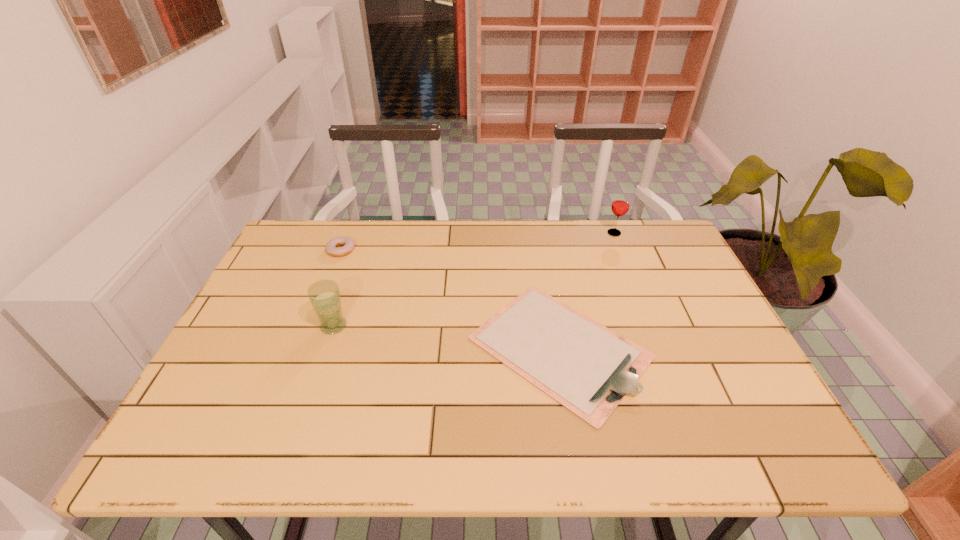
In the image, there is a desktop. Where is `free region at the far left corner`? The image size is (960, 540). free region at the far left corner is located at coordinates (290, 237).

The image size is (960, 540). In the image, there is a desktop. What are the coordinates of `vacant space at the near left corner` in the screenshot? It's located at (198, 424).

This screenshot has width=960, height=540. I want to click on blank space at the far right corner of the desktop, so click(x=636, y=245).

Locate an element on the screen. free space between the farther glass and the second shortest object is located at coordinates (478, 241).

This screenshot has width=960, height=540. Identify the location of unoccupied area between the left glass and the shortest object. (446, 336).

Identify the location of free spot between the farthest object and the third nearest object. This screenshot has width=960, height=540. (478, 241).

This screenshot has width=960, height=540. What are the coordinates of `free space between the third nearest object and the right glass` in the screenshot? It's located at (478, 241).

Where is `empty space that is in between the farther glass and the second farthest object`? This screenshot has width=960, height=540. empty space that is in between the farther glass and the second farthest object is located at coordinates (478, 241).

Image resolution: width=960 pixels, height=540 pixels. Identify the location of free space between the left glass and the farther glass. (474, 280).

Where is `unoccupied position between the left glass and the clipboard`? Image resolution: width=960 pixels, height=540 pixels. unoccupied position between the left glass and the clipboard is located at coordinates (446, 336).